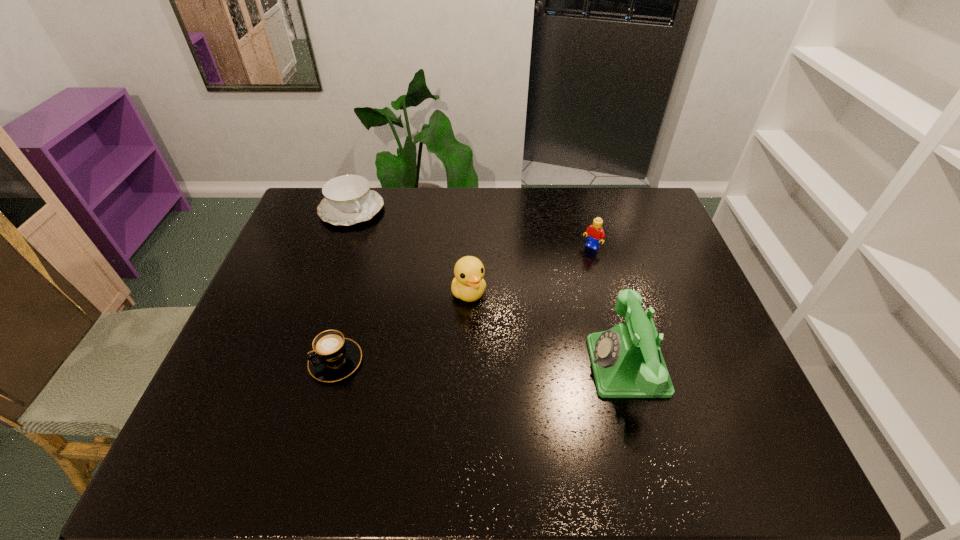
You are a GUI agent. You are given a task and a screenshot of the screen. Output one action in this format:
    pyautogui.click(x=<x>, y=<y>)
    Task: Click on the object that is positioned at the far edge
    
    Given the screenshot: What is the action you would take?
    pyautogui.click(x=347, y=200)

This screenshot has height=540, width=960. Find the location of `object located at the near edge`. object located at the near edge is located at coordinates (627, 362).

Where is `object situated at the left edge`? This screenshot has height=540, width=960. object situated at the left edge is located at coordinates (347, 200).

I want to click on object present at the far left corner, so click(347, 200).

At what (x,y) coordinates should I click in order to perform the action: click on free space at the far edge. Please return your answer as a coordinate pair (x, y). The image size is (960, 540). Looking at the image, I should click on pyautogui.click(x=392, y=205).

Locate an element on the screen. Image resolution: width=960 pixels, height=540 pixels. free space at the near edge of the desktop is located at coordinates (652, 406).

This screenshot has height=540, width=960. Find the location of `free spot at the left edge of the desktop`. free spot at the left edge of the desktop is located at coordinates (248, 315).

Find the location of a particular element. The width and height of the screenshot is (960, 540). vacant space at the far left corner of the desktop is located at coordinates (314, 186).

This screenshot has height=540, width=960. I want to click on vacant space at the far right corner, so click(631, 217).

Find the location of a particular element. The width and height of the screenshot is (960, 540). vacant space that is in between the second tallest object and the third tallest object is located at coordinates (530, 270).